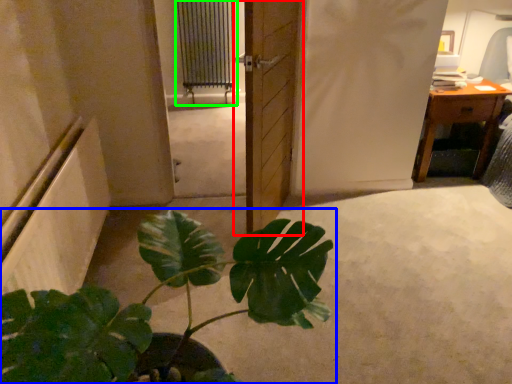
Question: Which object is positioned farthest from door (highlighted by a red box)? Select from houseplant (highlighted by a blue box) and radiator (highlighted by a green box).

Choices:
 (A) houseplant
 (B) radiator

Answer: (B)